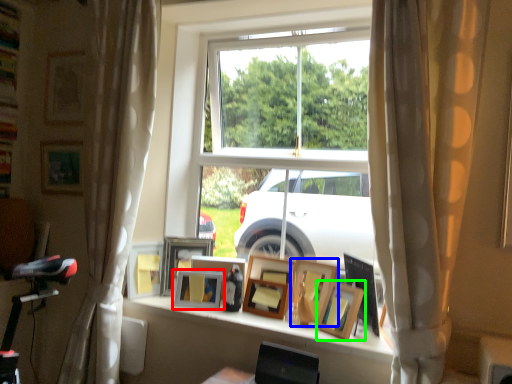
Question: Which object is positioned closest to picture frame (highlighted by a red box)? Select from picture frame (highlighted by a blue box) and picture frame (highlighted by a green box).

Choices:
 (A) picture frame
 (B) picture frame

Answer: (A)